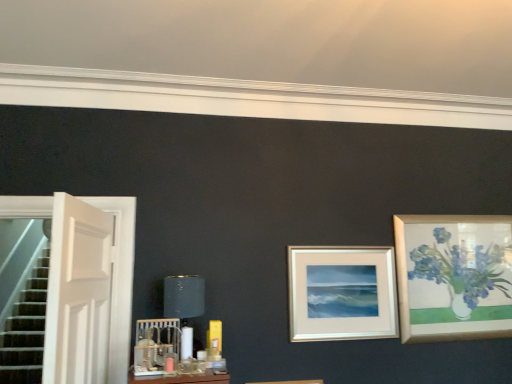
Question: Does point (180, 292) appear closer or farther from the camera than point (314, 276)?

Choices:
 (A) farther
 (B) closer

Answer: (B)

Question: In terms of size, does matte black lampshade at center appear bigger or smaller than silver/metallic picture frame at center?

Choices:
 (A) big
 (B) small

Answer: (A)

Question: Which object is the farthest from the matte black lampshade at center?

Choices:
 (A) white wooden door at left
 (B) silver/metallic picture frame at center

Answer: (B)

Question: Which object is the farthest from the matte black lampshade at center?

Choices:
 (A) silver/metallic picture frame at center
 (B) white wooden door at left

Answer: (A)